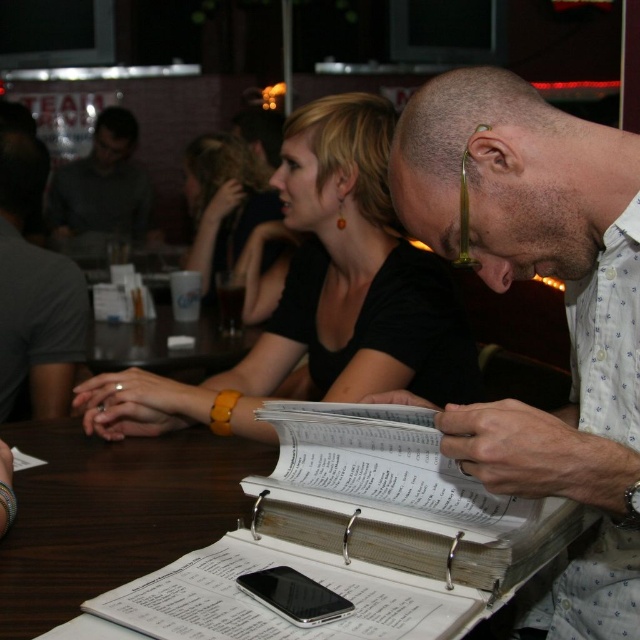
You are a guest at this event and want to place a small note on the table. Which object, the white paper at center or the black matte hair at center, would allow you to write a larger note without overlapping other items?

The black matte hair at center occupies more space than the white paper at center, so you should choose the white paper at center for a smaller note or the black matte hair at center for a larger one. However, since the black matte hair at center is part of a person, it isn

You are sitting at the brown wooden table at center and want to hand a document to the person wearing the gray fabric shirt at upper left. Which direction should you move to reach them?

Since the brown wooden table at center is closer to you than the gray fabric shirt at upper left, you should move forward towards the gray fabric shirt at upper left to reach them.

You are a photographer taking a picture of the scene. You notice the white paper at center and the black matte hair at center. Which object should you focus on to ensure it appears clearer in the photo?

The white paper at center is closer to the viewer than the black matte hair at center, so focusing on the white paper at center will ensure it appears clearer in the photo.